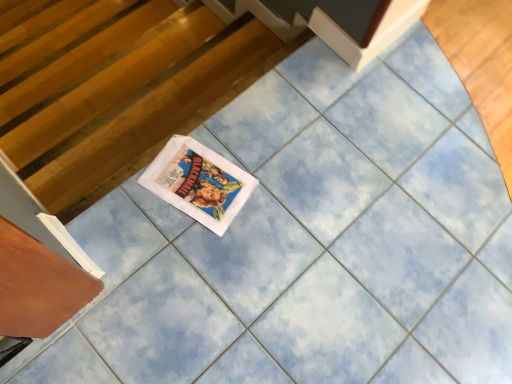
Identify the location of free point to the left of white paper comic book at center. pos(120,195).